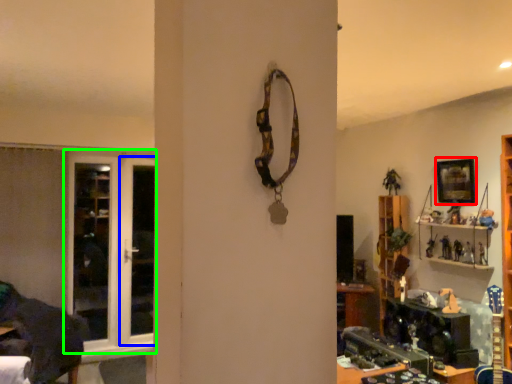
Question: Considering the real-world distances, which object is farthest from picture frame (highlighted by a red box)? screen door (highlighted by a blue box) or door (highlighted by a green box)?

Choices:
 (A) screen door
 (B) door

Answer: (B)